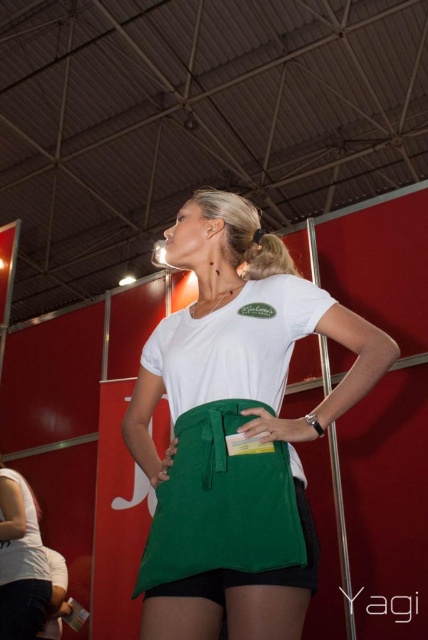
Question: Can you confirm if white fabric shirt at center is positioned to the left of white matte t-shirt at center?

Choices:
 (A) yes
 (B) no

Answer: (B)

Question: Which point is closer to the camera?

Choices:
 (A) shiny brown hair at upper center
 (B) white matte t-shirt at center

Answer: (A)

Question: Which point appears closest to the camera in this image?

Choices:
 (A) (228, 627)
 (B) (32, 554)

Answer: (A)

Question: Is white fabric shirt at center thinner than white matte t-shirt at center?

Choices:
 (A) yes
 (B) no

Answer: (B)

Question: Among these points, which one is nearest to the camera?

Choices:
 (A) (14, 572)
 (B) (199, 627)

Answer: (B)

Question: Is white fabric shirt at center bigger than white matte t-shirt at center?

Choices:
 (A) no
 (B) yes

Answer: (B)